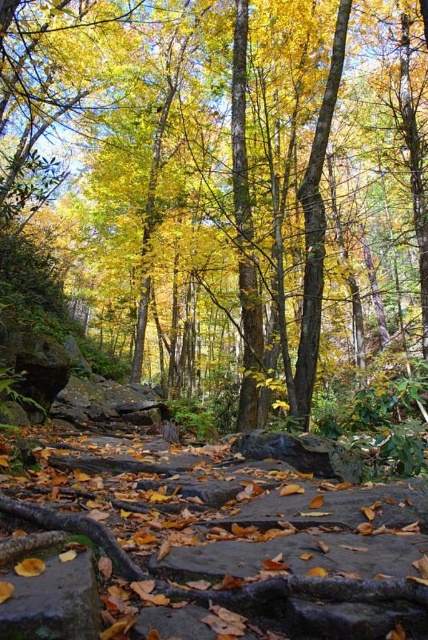
Question: Does yellow leaves at center have a lesser width compared to smooth gray rock at lower left?

Choices:
 (A) yes
 (B) no

Answer: (B)

Question: Does yellow leaves at center appear over smooth gray rock at lower left?

Choices:
 (A) yes
 (B) no

Answer: (A)

Question: Which of the following is the farthest from the observer?

Choices:
 (A) (252, 282)
 (B) (65, 604)

Answer: (A)

Question: Does yellow leaves at center have a larger size compared to smooth gray rock at lower left?

Choices:
 (A) no
 (B) yes

Answer: (B)

Question: Which point appears closest to the camera in this image?

Choices:
 (A) (56, 556)
 (B) (145, 376)

Answer: (A)